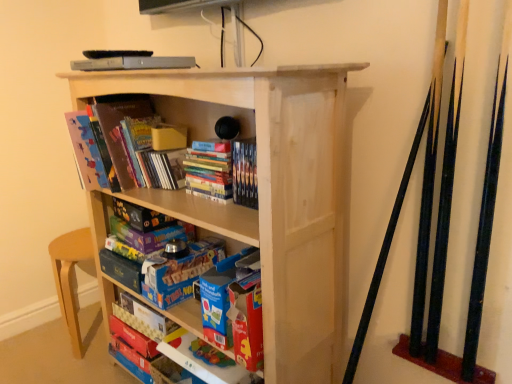
Question: In terms of width, does matte cardboard book at lower center, positioned as the third book in top-to-bottom order, look wider or thinner when compared to matte cardboard book at left, which appears as the first book when viewed from the top?

Choices:
 (A) wide
 (B) thin

Answer: (B)

Question: From a real-world perspective, relative to matte cardboard book at left, which appears as the third book when ordered from the bottom, is matte cardboard book at lower center, positioned as the third book in top-to-bottom order, vertically above or below?

Choices:
 (A) below
 (B) above

Answer: (A)

Question: Which object is the farthest from the matte cardboard book at left, which appears as the first book when viewed from the top?

Choices:
 (A) hardcover books at center, which appears as the 2th book when ordered from the bottom
 (B) matte cardboard book at lower center, which is counted as the 1th book, starting from the bottom
 (C) natural wood bookcase at center

Answer: (B)

Question: Estimate the real-world distances between objects in this image. Which object is farther from the natural wood bookcase at center?

Choices:
 (A) matte cardboard book at lower center, positioned as the third book in top-to-bottom order
 (B) matte cardboard book at left, which appears as the third book when ordered from the bottom
 (C) hardcover books at center, which appears as the 2th book when ordered from the bottom

Answer: (A)